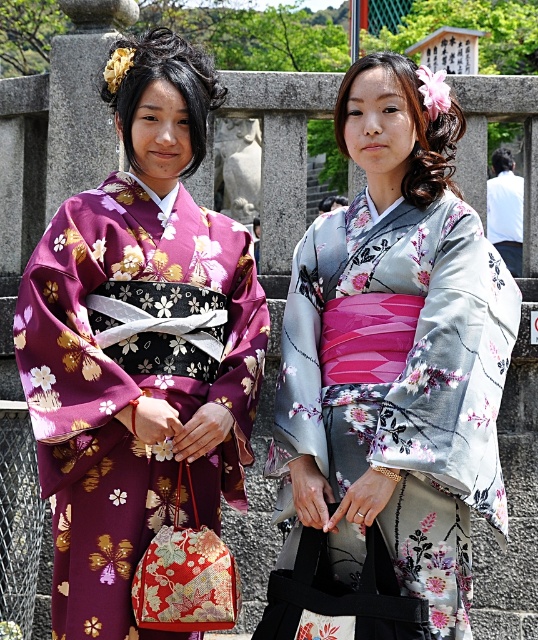
Question: Which object appears farthest from the camera in this image?

Choices:
 (A) matte floral kimono at center
 (B) silky floral kimono at center

Answer: (A)

Question: Which of the following is the farthest from the observer?

Choices:
 (A) (137, 61)
 (B) (455, 189)

Answer: (B)

Question: Does matte floral kimono at center appear under silky floral kimono at center?

Choices:
 (A) yes
 (B) no

Answer: (B)

Question: Considering the relative positions of matte floral kimono at center and silky floral kimono at center in the image provided, where is matte floral kimono at center located with respect to silky floral kimono at center?

Choices:
 (A) above
 (B) below

Answer: (A)

Question: Is matte floral kimono at center below silky floral kimono at center?

Choices:
 (A) yes
 (B) no

Answer: (B)